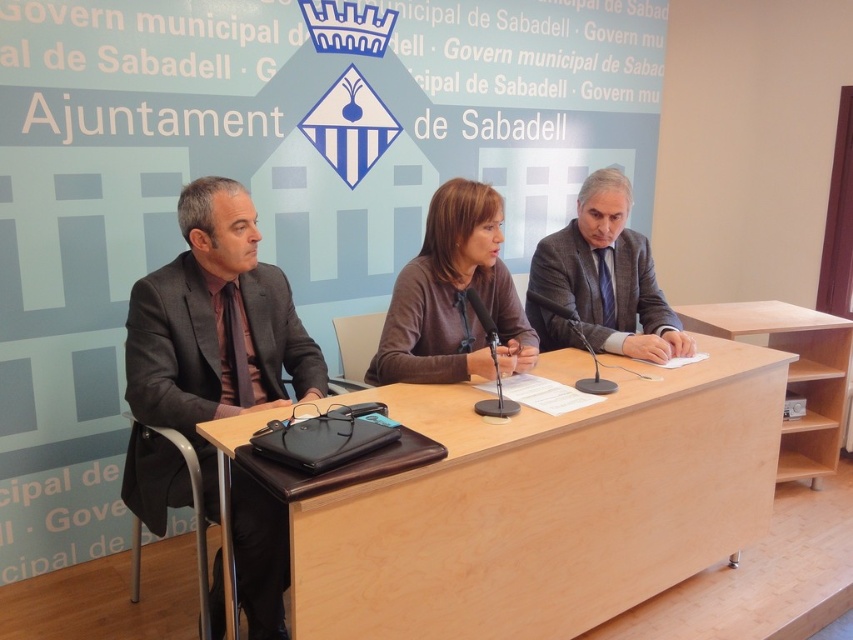
You are attending a press conference at the Ajuntament de Sabadell. You need to locate the dark gray suit at center. What are its coordinates?

The dark gray suit at center is located at coordinates point (215, 326).